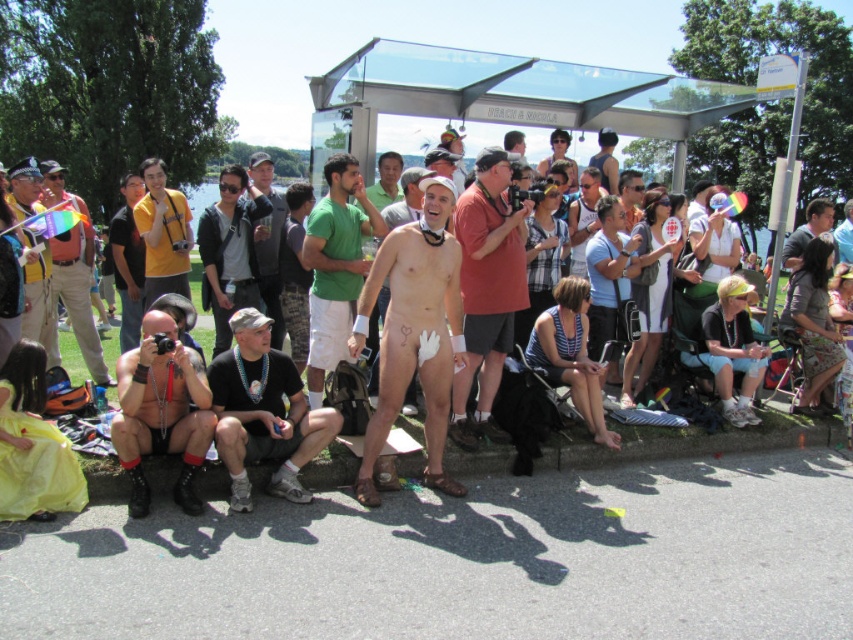
Question: Is white matte towel at center above green matte shorts at center?

Choices:
 (A) yes
 (B) no

Answer: (B)

Question: In this image, where is matte red shirt at center located relative to gray fabric shirt at center?

Choices:
 (A) right
 (B) left

Answer: (B)

Question: Is green matte shorts at center thinner than matte yellow hat at left?

Choices:
 (A) no
 (B) yes

Answer: (B)

Question: Among these objects, which one is farthest from the camera?

Choices:
 (A) matte black camera at left
 (B) green t-shirt at center
 (C) matte black camera at lower left

Answer: (B)

Question: Among these objects, which one is nearest to the camera?

Choices:
 (A) gray fabric shirt at center
 (B) matte yellow hat at left

Answer: (B)

Question: Considering the real-world distances, which object is closest to the matte red shirt at center?

Choices:
 (A) matte black camera at lower left
 (B) matte gray hoodie at center
 (C) green matte shorts at center

Answer: (C)